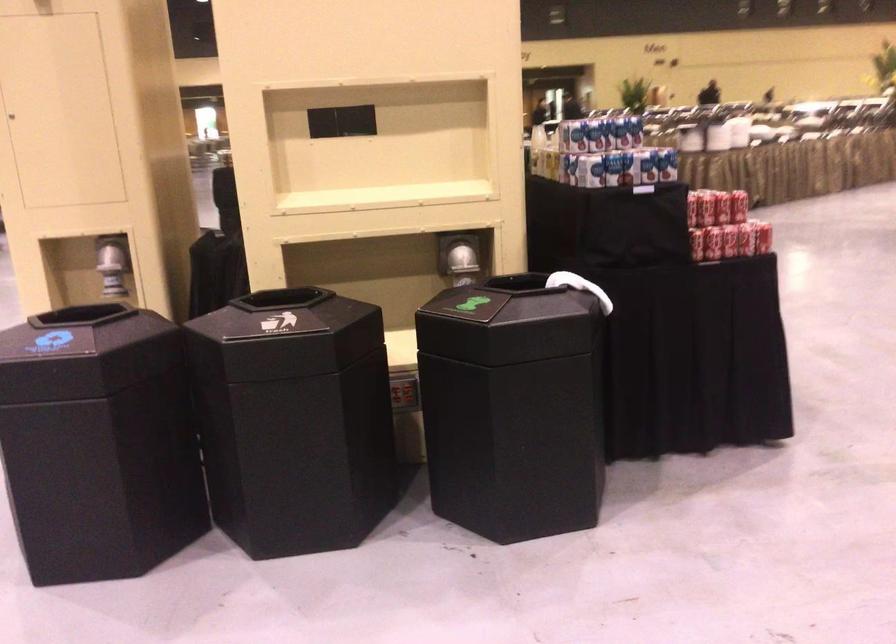
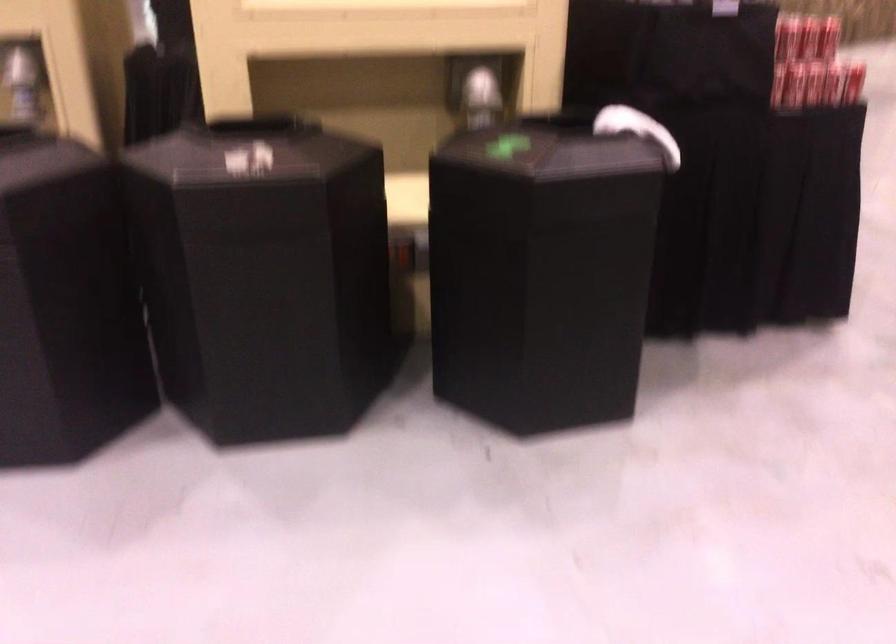
Question: How did the camera likely rotate?

Choices:
 (A) Left
 (B) Right
 (C) Up
 (D) Down

Answer: (D)